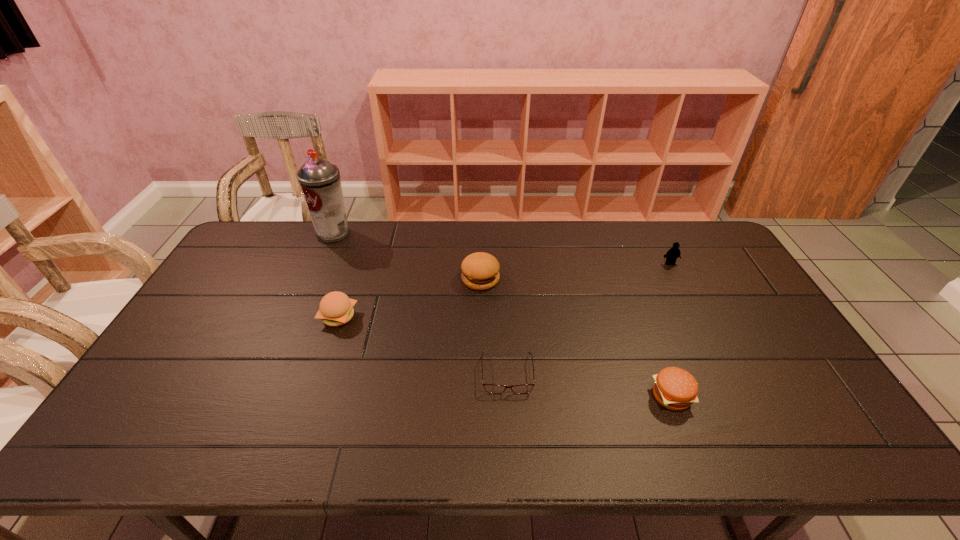
This screenshot has width=960, height=540. Find the location of `the leftmost object`. the leftmost object is located at coordinates (319, 180).

I want to click on aerosol can, so click(x=319, y=180).

Locate an element on the screen. the rightmost object is located at coordinates (671, 256).

The image size is (960, 540). Identify the location of Lego. (671, 256).

In order to click on the second hamburger from right to left in this screenshot , I will do `click(480, 271)`.

The image size is (960, 540). I want to click on the fourth nearest object, so click(480, 271).

Locate an element on the screen. the second farthest hamburger is located at coordinates (336, 308).

I want to click on the fifth object from right to left, so click(x=336, y=308).

At what (x,y) coordinates should I click in order to perform the action: click on the shortest hamburger. Please return your answer as a coordinate pair (x, y). This screenshot has height=540, width=960. Looking at the image, I should click on (674, 388).

Find the location of a particular element. Image resolution: width=960 pixels, height=540 pixels. the second object from right to left is located at coordinates (674, 388).